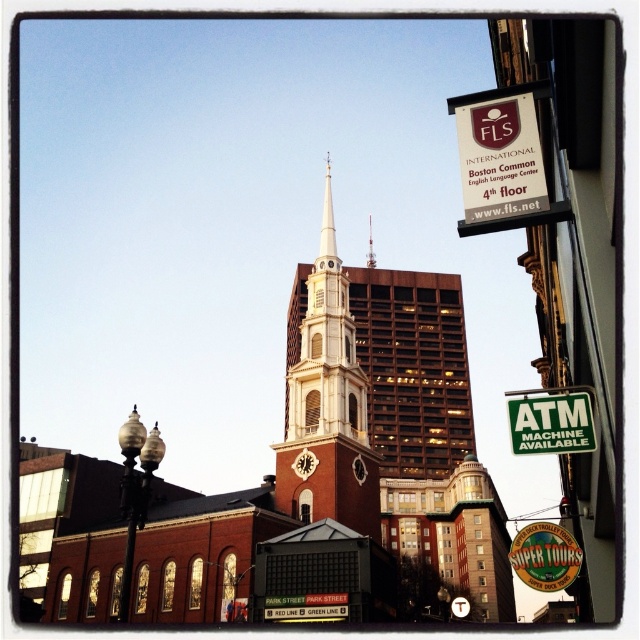
Who is more distant from viewer, (557, 428) or (330, 160)?

Point (330, 160)

Can you confirm if green plastic atm machine available sign at upper right is shorter than white steeple at center?

Yes.

Between point (573, 433) and point (328, 220), which one is positioned behind?

Positioned behind is point (328, 220).

Locate an element on the screen. The height and width of the screenshot is (640, 640). green plastic atm machine available sign at upper right is located at coordinates (552, 422).

Does white stone clock tower at center come behind silver metallic spire at center?

→ No, it is in front of silver metallic spire at center.

Looking at this image, how far apart are white stone clock tower at center and silver metallic spire at center?

white stone clock tower at center and silver metallic spire at center are 90.56 meters apart from each other.

This screenshot has width=640, height=640. I want to click on white stone clock tower at center, so click(x=326, y=404).

Does brown brick church at center appear on the right side of green plastic atm machine available sign at upper right?

Indeed, brown brick church at center is positioned on the right side of green plastic atm machine available sign at upper right.

Who is positioned more to the right, brown brick church at center or green plastic atm machine available sign at upper right?

brown brick church at center

Between point (355, 458) and point (561, 413), which one is positioned behind?

The point (355, 458) is more distant.

You are a GUI agent. You are given a task and a screenshot of the screen. Output one action in this format:
    pyautogui.click(x=<x>, y=<y>)
    Task: Click on the brown brick church at center
    The height and width of the screenshot is (640, 640).
    Given the screenshot: What is the action you would take?
    pyautogui.click(x=310, y=484)